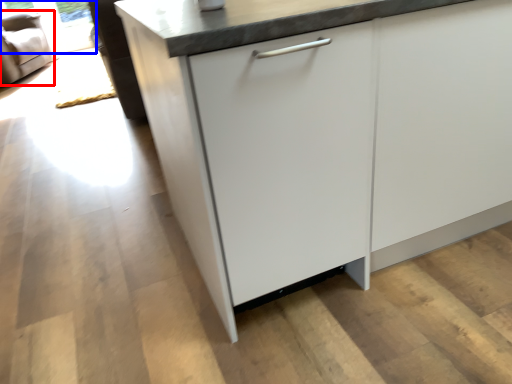
Question: Which point is closer to the camera, armchair (highlighted by a red box) or window screen (highlighted by a blue box)?

Choices:
 (A) armchair
 (B) window screen

Answer: (A)